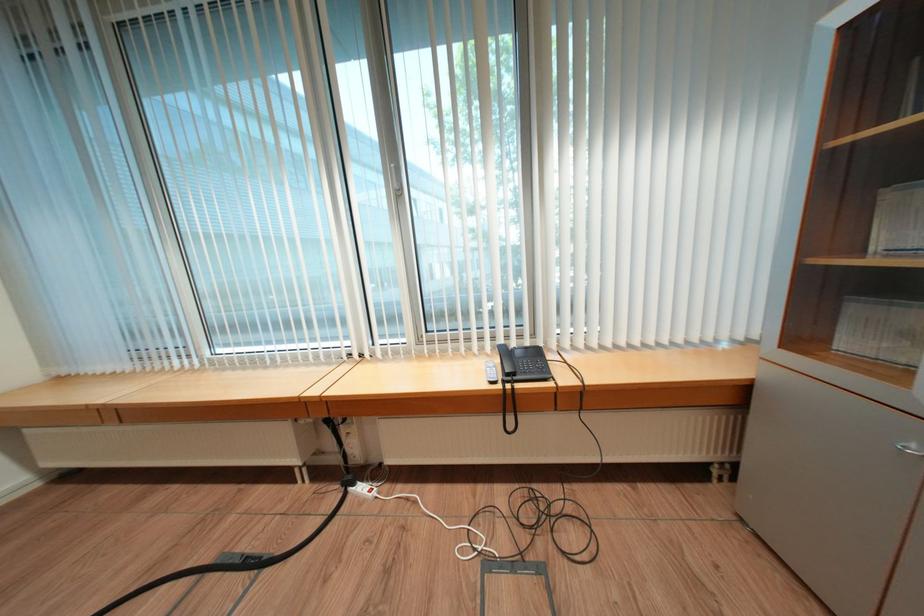
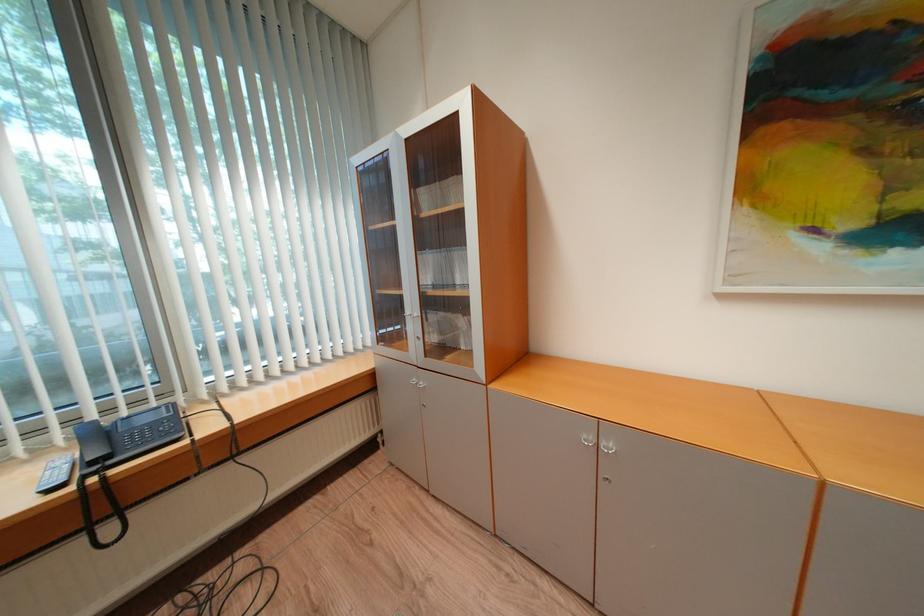
Where in the second image is the point corresponding to (514,353) from the first image?

(104, 434)